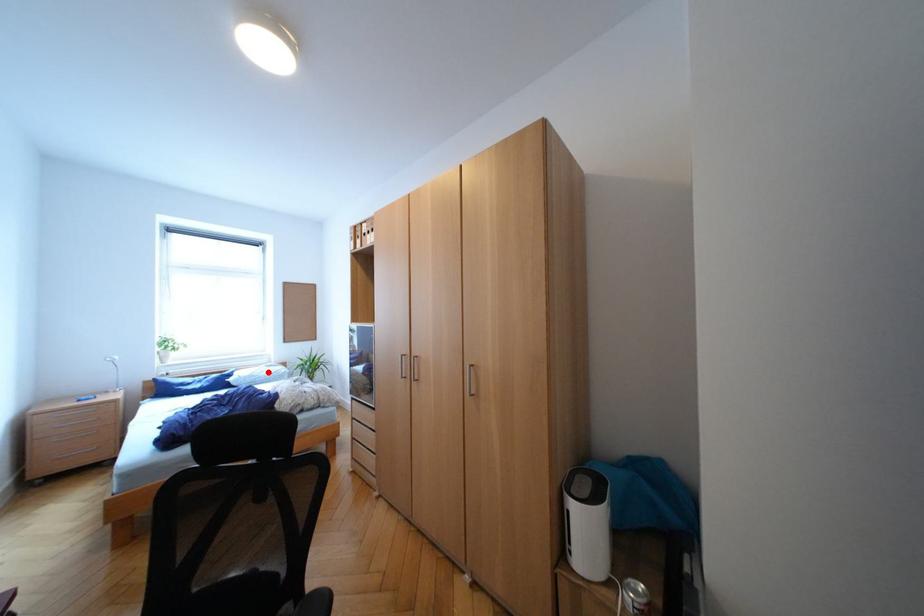
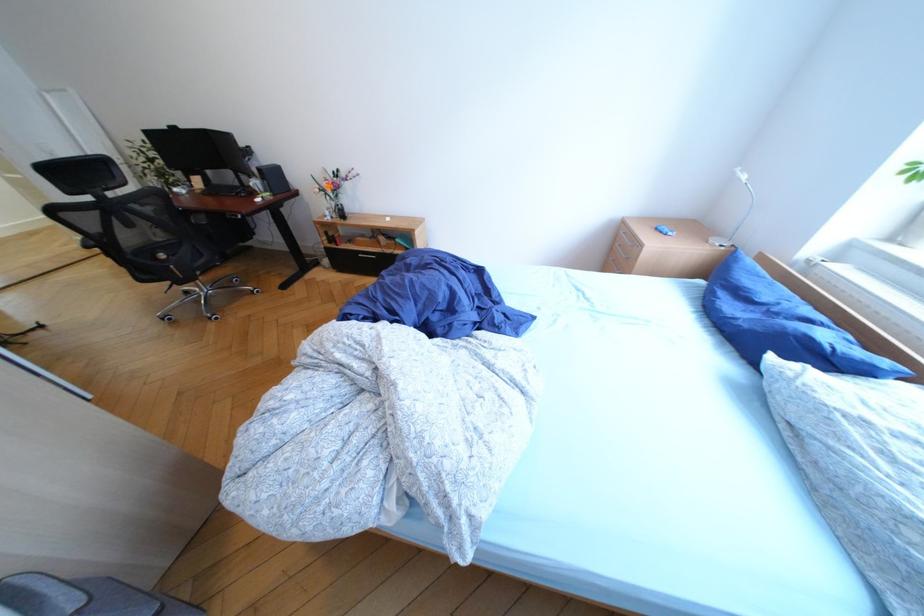
In the second image, find the point that corresponds to the highlighted location in the first image.

(912, 448)